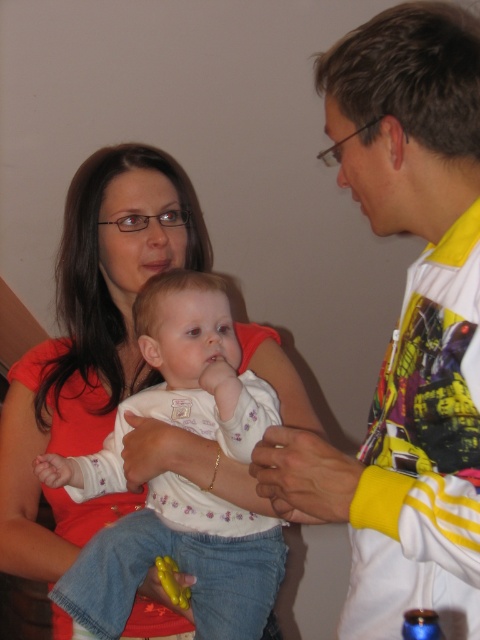
Is yellow/white jacket at right positioned at the back of matte orange shirt at upper left?

No, yellow/white jacket at right is closer to the viewer.

Is point (411, 58) behind point (156, 269)?

No, (411, 58) is in front of (156, 269).

Image resolution: width=480 pixels, height=640 pixels. Identify the location of yellow/white jacket at right. (406, 324).

The width and height of the screenshot is (480, 640). Find the location of `yellow/white jacket at right`. yellow/white jacket at right is located at coordinates (406, 324).